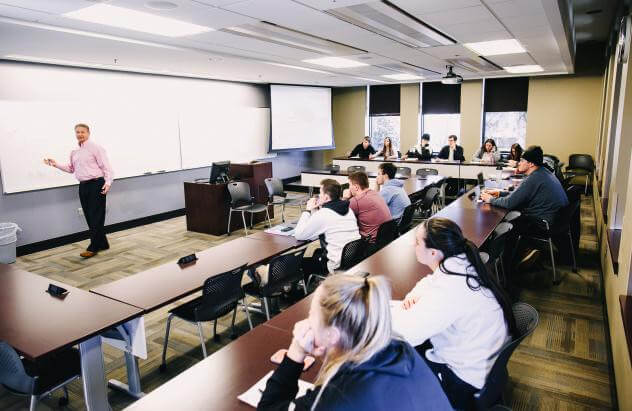
This screenshot has width=632, height=411. What are the coordinates of `windows` in the screenshot? It's located at (392, 101), (442, 94), (495, 92), (624, 180), (612, 144).